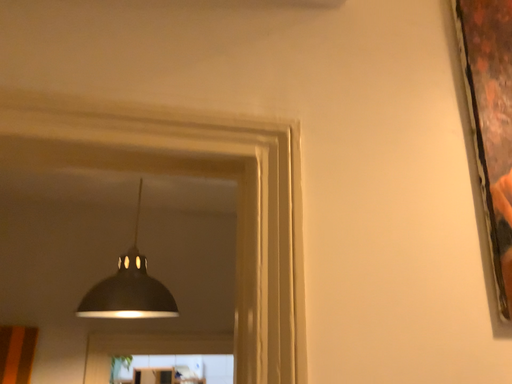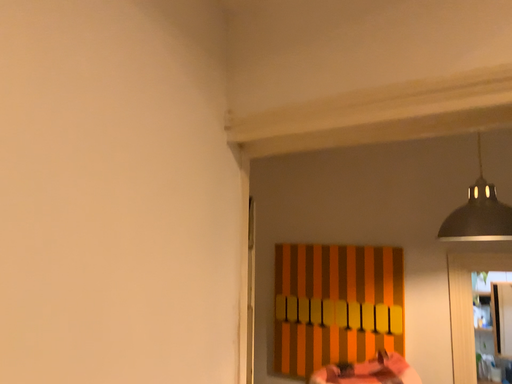
Question: How did the camera likely rotate when shooting the video?

Choices:
 (A) rotated left
 (B) rotated right

Answer: (A)